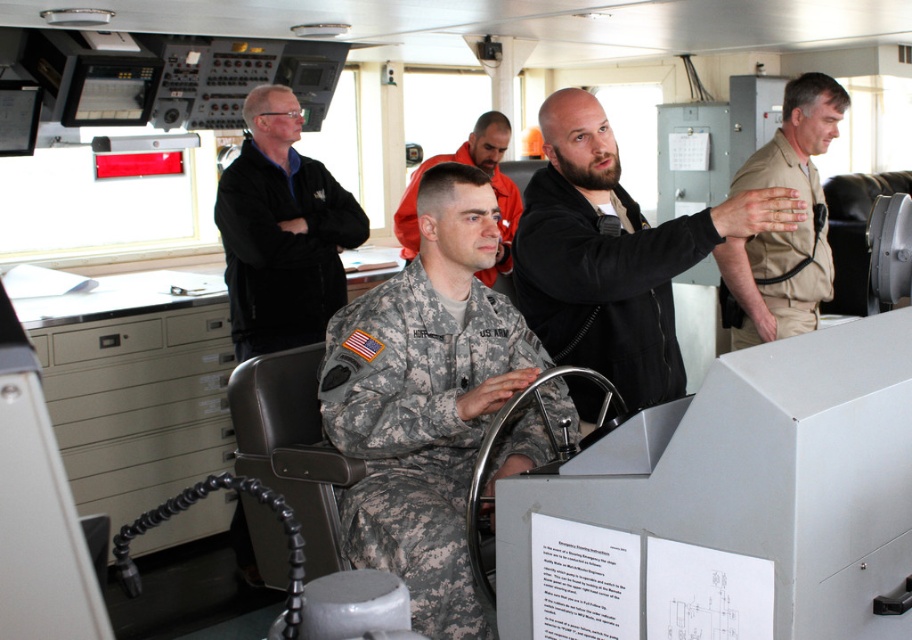
From the picture: You are navigating a ship and need to locate the person in the tan uniform at right. According to the coordinates provided, where would you find them in the image?

The tan uniform at right is located at coordinates point (778, 252) in the image.

Consider the image. You are a new crew member on the ship and need to locate the two central figures. According to the scene, where exactly are the black matte jacket at center and the camouflage uniform at center positioned relative to each other?

The black matte jacket at center is positioned below the camouflage uniform at center in the scene.